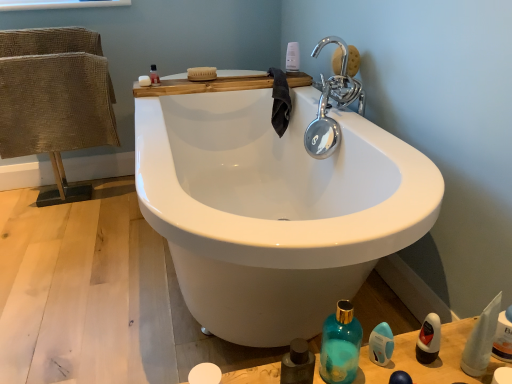
The height and width of the screenshot is (384, 512). Identify the location of vacant region to the left of white fabric towel at lower right, which is counted as the third toiletry, starting from the left. (415, 363).